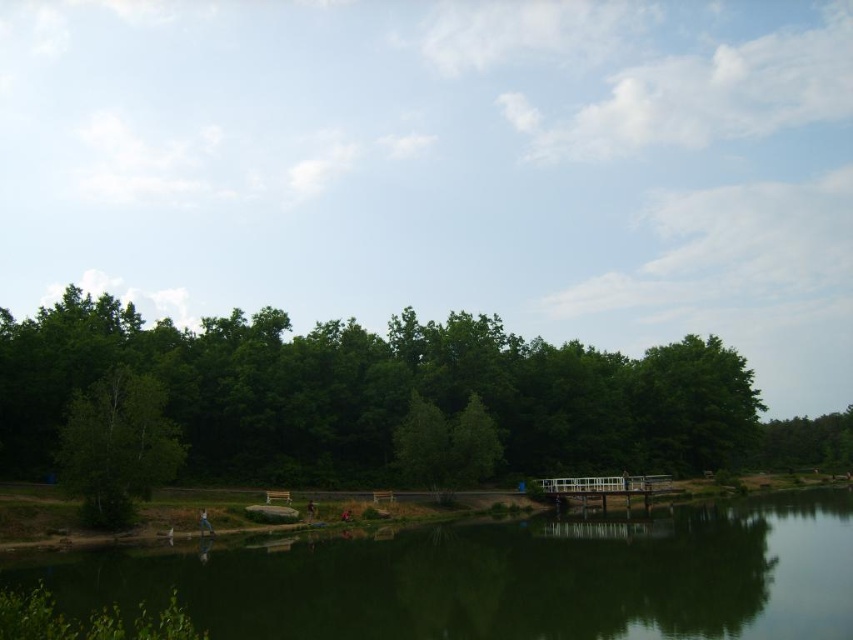
You are planning to take a photo of the green leafy trees at center and the green reflective water at lower center. Which object will occupy more space in your photo?

The green leafy trees at center will occupy more space in the photo because they are larger in size than the green reflective water at lower center according to the description.

You are planning to take a photo of the green reflective water at lower center and the green matte tree at left. Which object should you focus on first if you want to capture both in a single frame without moving the camera?

The green reflective water at lower center is bigger than the green matte tree at left, so you should focus on the larger object first to ensure it fills the frame appropriately before adjusting for the smaller one.

You are standing at the lakeside and want to take a photo of the green leafy trees at center and the green matte tree at left. Which tree group will appear closer to the bottom of your photo?

The green leafy trees at center will appear closer to the bottom of your photo because they are positioned below the green matte tree at left.